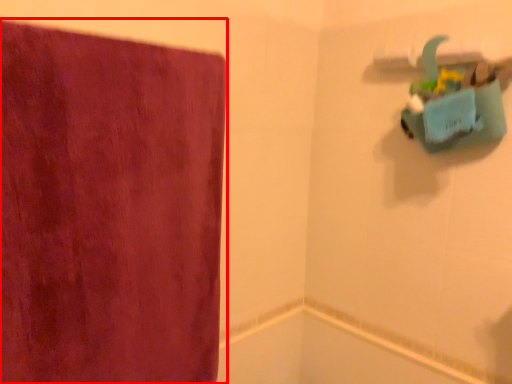
Question: From the image's perspective, where is towel (annotated by the red box) located in relation to bath in the image?

Choices:
 (A) below
 (B) above

Answer: (B)